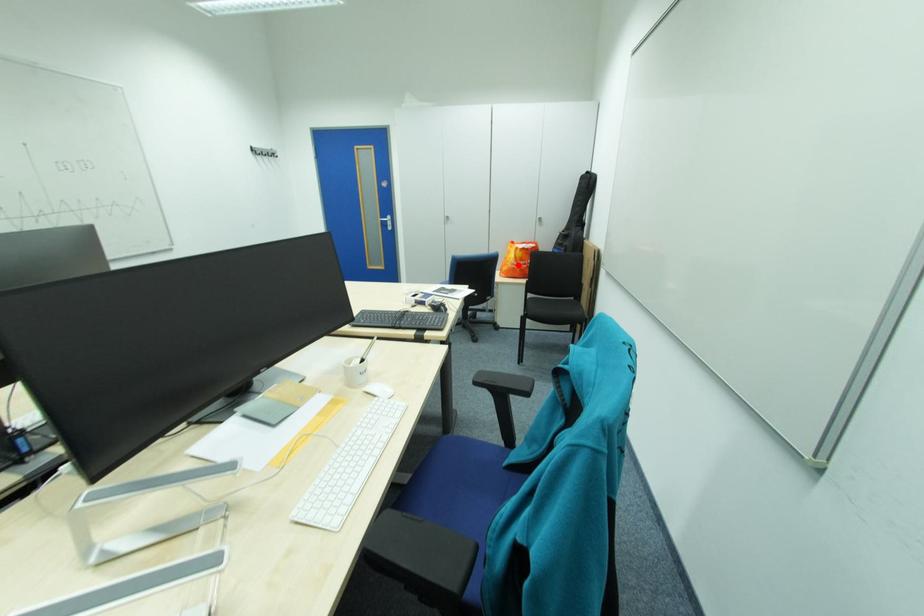
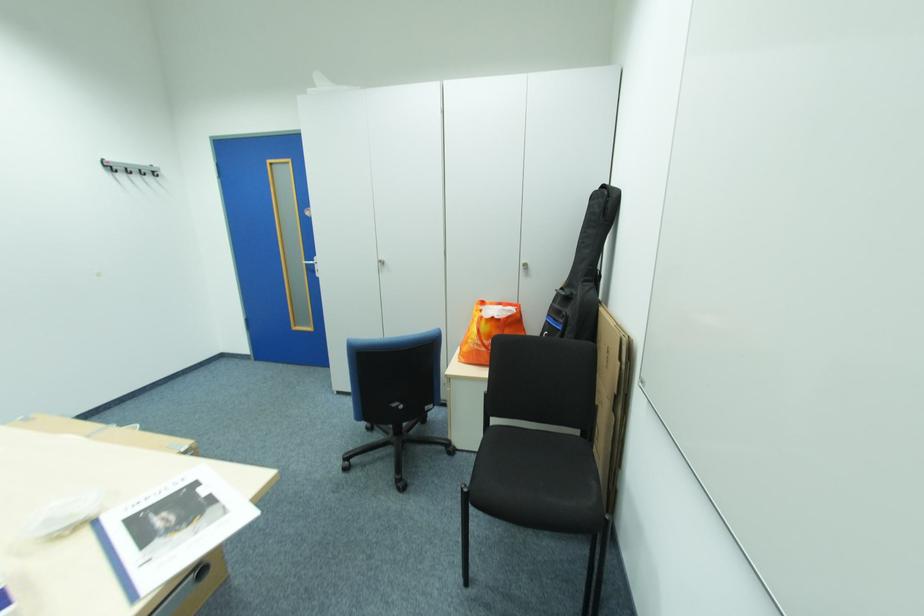
Where in the second image is the point corresponding to the highlighted location from the first image?

(480, 345)